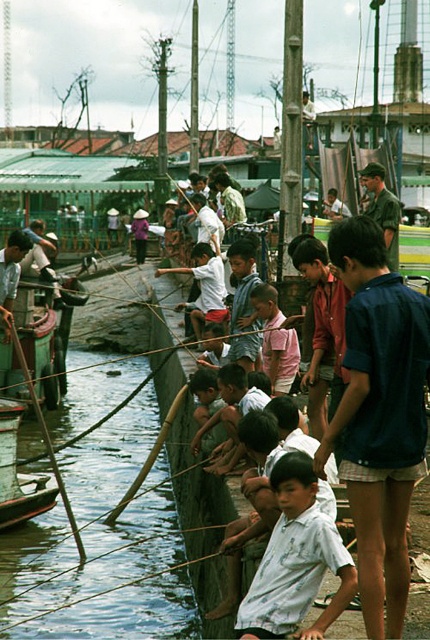
You are a photographer trying to capture a photo of the white cotton shirt at center and the wooden boat at lower left. You want to ensure both subjects are in the frame without any overlap. Given their widths, can you position the camera so both fit side by side horizontally?

The white cotton shirt at center might be wider than wooden boat at lower left. Therefore, it is uncertain if they can fit side by side horizontally without overlapping. The photographer should adjust the camera angle or distance to accommodate the potential width difference.

Looking at this image, you are a photographer standing on the wooden pier at the riverside. You notice a white cotton shirt at center and a wooden boat at lower left in your viewfinder. Which object would appear smaller in your photo?

The white cotton shirt at center appears smaller in the photo because it is not as tall as the wooden boat at lower left.

You are a photographer standing at the riverside and want to capture both the green bamboo pole at left and the white cotton shirt at center in your frame. Which object should you focus on first if you want to ensure both are in focus?

The green bamboo pole at left is larger in size compared to the white cotton shirt at center, so focusing on the larger object first would help ensure both are in focus.